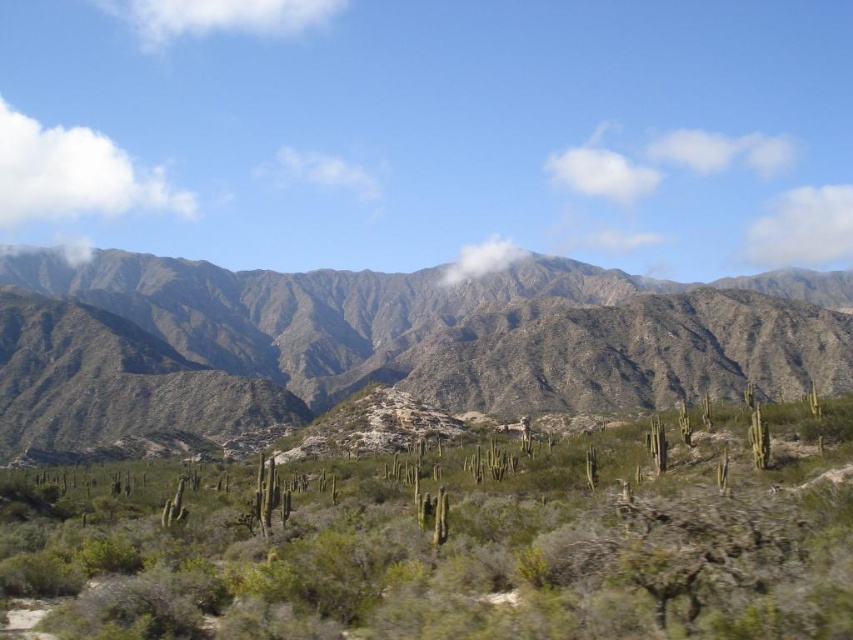
Can you confirm if green spiky cactus at center is positioned below green textured mountain range at center?

Yes.

Does point (759, 548) come in front of point (177, 266)?

Yes, it is.

The width and height of the screenshot is (853, 640). I want to click on green spiky cactus at center, so click(450, 541).